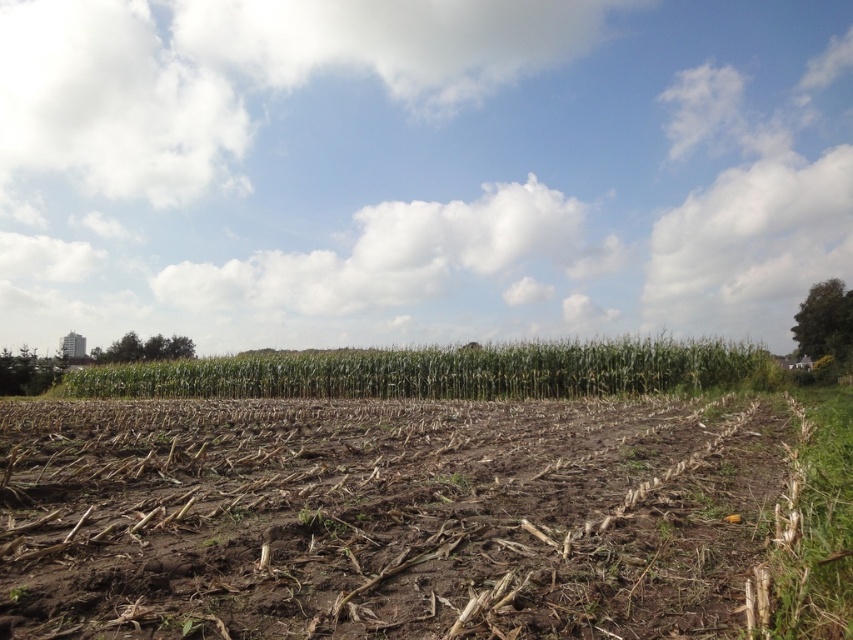
Question: Which of the following is the farthest from the observer?

Choices:
 (A) (579, 506)
 (B) (740, 349)

Answer: (B)

Question: Can you confirm if brown dirt at center is wider than green leafy corn at center?

Choices:
 (A) yes
 (B) no

Answer: (B)

Question: Is brown dirt at center positioned in front of green leafy corn at center?

Choices:
 (A) yes
 (B) no

Answer: (A)

Question: Which point is closer to the camera?

Choices:
 (A) brown dirt at center
 (B) green leafy corn at center

Answer: (A)

Question: Is the position of brown dirt at center more distant than that of green leafy corn at center?

Choices:
 (A) yes
 (B) no

Answer: (B)

Question: Which object is closer to the camera taking this photo?

Choices:
 (A) brown dirt at center
 (B) green leafy corn at center

Answer: (A)